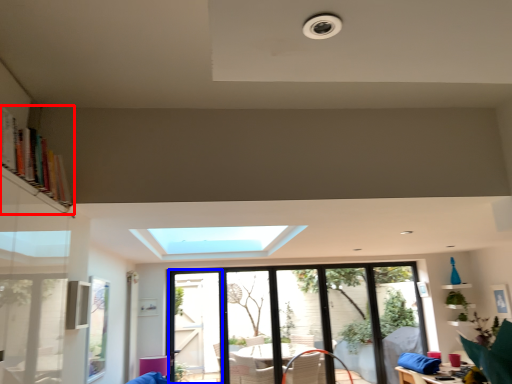
Question: Which object appears farthest to the camera in this image, bookshelf (highlighted by a red box) or screen door (highlighted by a blue box)?

Choices:
 (A) bookshelf
 (B) screen door

Answer: (B)